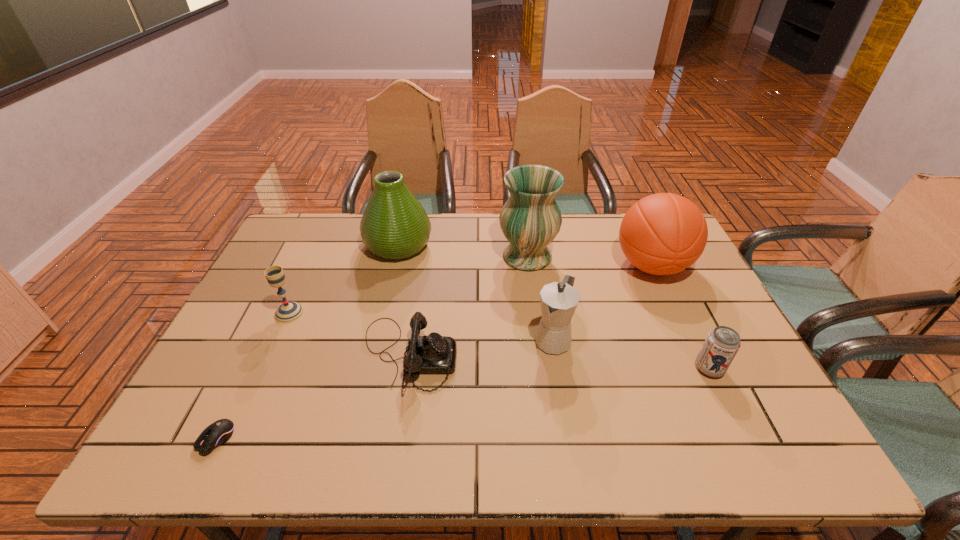
The height and width of the screenshot is (540, 960). I want to click on the closest object to the basketball, so click(x=530, y=219).

This screenshot has height=540, width=960. In order to click on free location that satisfies the following two spatial constraints: 1. on the front side of the fourth tallest object; 2. on the right side of the chalice in this screenshot , I will do pyautogui.click(x=277, y=339).

Find the location of a particular element. free space that satisfies the following two spatial constraints: 1. on the front side of the fourth shortest object; 2. on the right side of the third shortest object is located at coordinates (264, 368).

This screenshot has height=540, width=960. I want to click on vacant space that satisfies the following two spatial constraints: 1. on the front side of the beer can; 2. on the left side of the right vase, so click(541, 368).

This screenshot has width=960, height=540. Identify the location of free location that satisfies the following two spatial constraints: 1. on the back side of the fourth shortest object; 2. on the right side of the left vase. (320, 245).

At what (x,y) coordinates should I click in order to perform the action: click on free space that satisfies the following two spatial constraints: 1. on the front side of the right vase; 2. on the right side of the coffeepot. Please return your answer as a coordinate pair (x, y). The height and width of the screenshot is (540, 960). Looking at the image, I should click on tap(538, 339).